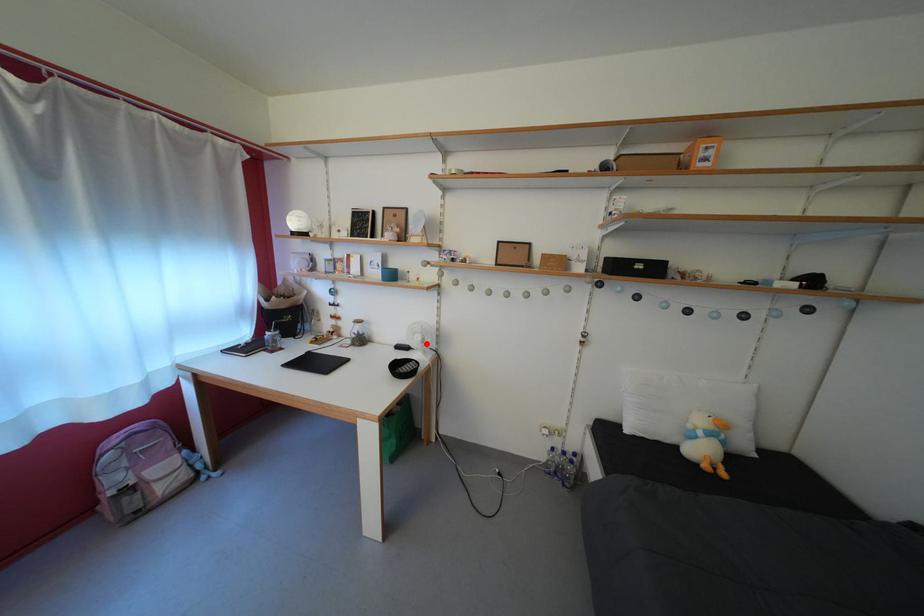
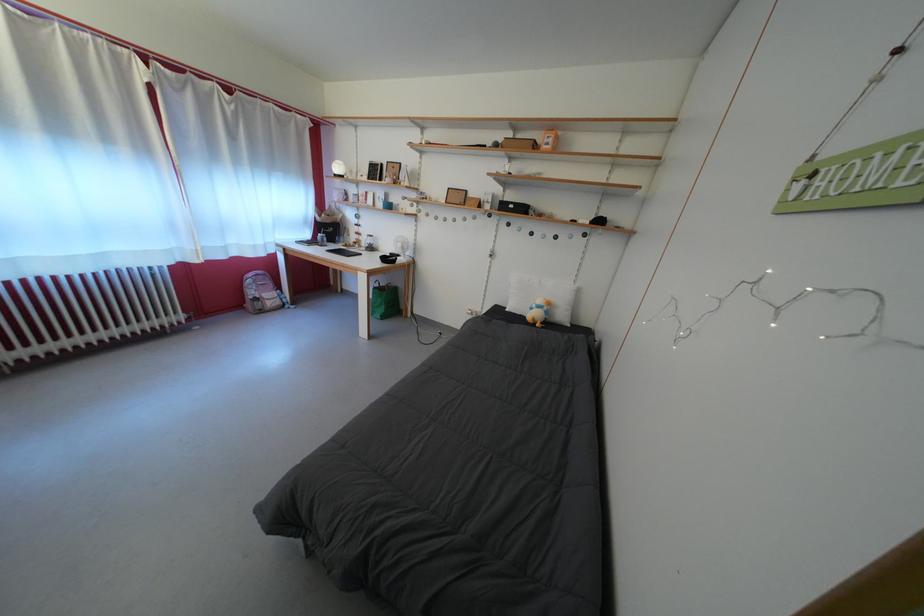
Question: I am providing you with two images of the same scene from different viewpoints. Image1 has a red point marked. In image2, the corresponding 3D location appears at what relative position? Reply with the corresponding letter.

Choices:
 (A) Closer
 (B) Farther

Answer: (A)